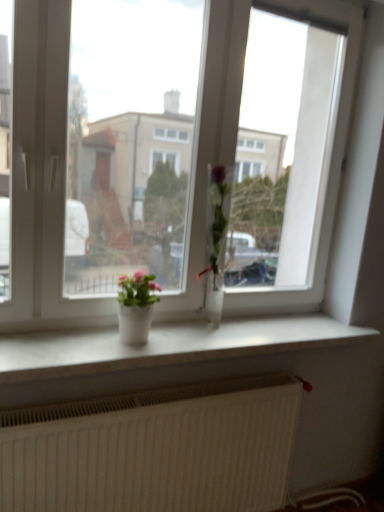
Identify the location of free location to the left of matte white pot at center, which is the second houseplant in right-to-left order. (88, 336).